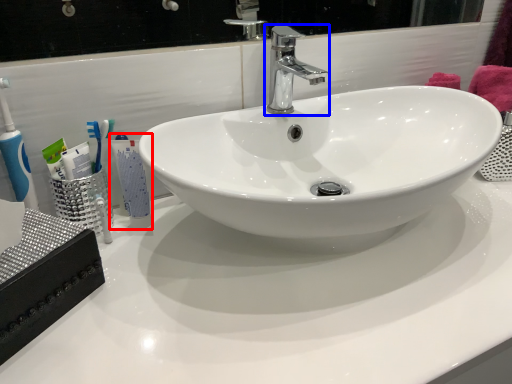
Question: Which of the following is the closest to the observer, mouthwash (highlighted by a red box) or tap (highlighted by a blue box)?

Choices:
 (A) mouthwash
 (B) tap

Answer: (B)